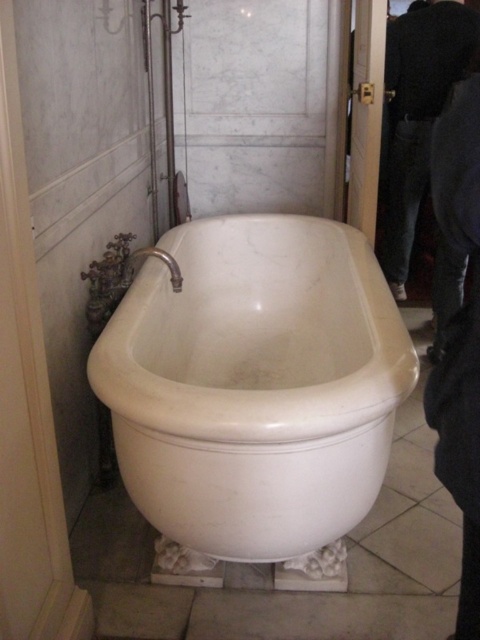
Does white marble bathtub at center come in front of dark gray jeans at right?

Yes, it is.

From the picture: Which is above, white marble bathtub at center or dark gray jeans at right?

Positioned higher is dark gray jeans at right.

Identify the location of white marble bathtub at center. 254,385.